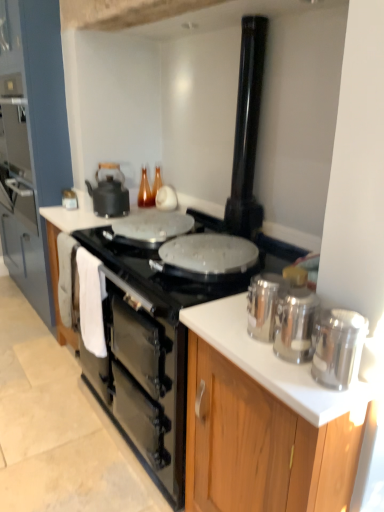
Where is `free space on the front side of polished stainless steel canisters at right, marked as the 2th kitchen appliance in a right-to-left arrangement`? The image size is (384, 512). free space on the front side of polished stainless steel canisters at right, marked as the 2th kitchen appliance in a right-to-left arrangement is located at coordinates (295, 382).